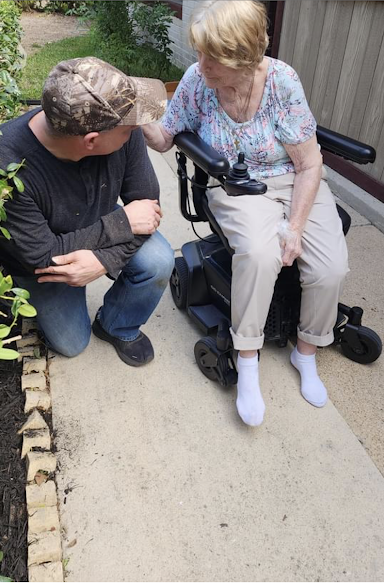
The width and height of the screenshot is (384, 583). What are the coordinates of `plant` in the screenshot? It's located at (20, 307), (153, 24), (113, 20).